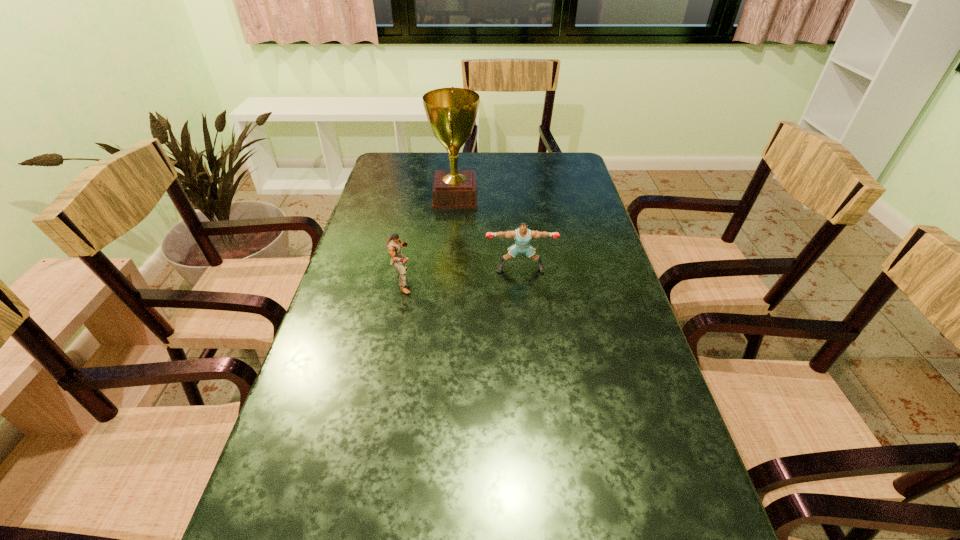
Where is `vacant space at the left edge`? vacant space at the left edge is located at coordinates (350, 428).

Identify the location of free space at the right edge. (633, 347).

Where is `free space at the far left corner of the desktop`? This screenshot has width=960, height=540. free space at the far left corner of the desktop is located at coordinates (389, 176).

Where is `free space that is in between the farthest object and the leftmost object`? free space that is in between the farthest object and the leftmost object is located at coordinates (429, 239).

Locate an element on the screen. This screenshot has width=960, height=540. vacant space in between the rightmost object and the left puncher is located at coordinates (462, 274).

Identify the location of unoccupied position between the leftmost object and the award. Image resolution: width=960 pixels, height=540 pixels. (429, 239).

Where is `free space that is in between the left puncher and the right puncher`? The height and width of the screenshot is (540, 960). free space that is in between the left puncher and the right puncher is located at coordinates (462, 274).

Locate an element on the screen. Image resolution: width=960 pixels, height=540 pixels. free space that is in between the left puncher and the rightmost object is located at coordinates (462, 274).

Select which object appears as the closest to the tallest object. Please provide its 2D coordinates. Your answer should be formatted as a tuple, i.e. [(x, y)], where the tuple contains the x and y coordinates of a point satisfying the conditions above.

[(522, 236)]

Locate which object is the second closest to the leftmost object. Please provide its 2D coordinates. Your answer should be formatted as a tuple, i.e. [(x, y)], where the tuple contains the x and y coordinates of a point satisfying the conditions above.

[(451, 112)]